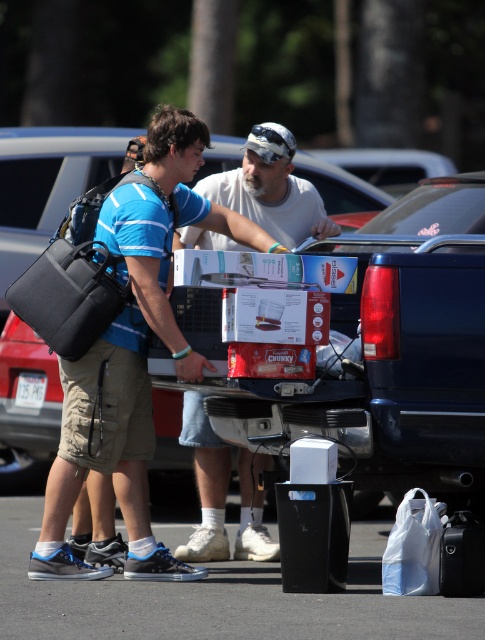
Question: Does red cardboard boxes at center appear over matte black backpack at left?

Choices:
 (A) yes
 (B) no

Answer: (A)

Question: Which point is farther to the camera?

Choices:
 (A) red cardboard boxes at center
 (B) matte black backpack at left
 (C) white matte shirt at center

Answer: (C)

Question: Considering the relative positions of red cardboard boxes at center and matte black backpack at left in the image provided, where is red cardboard boxes at center located with respect to matte black backpack at left?

Choices:
 (A) above
 (B) below

Answer: (A)

Question: Which object appears closest to the camera in this image?

Choices:
 (A) white matte shirt at center
 (B) matte black backpack at left

Answer: (B)

Question: Which point is farther to the camera?

Choices:
 (A) coord(231,173)
 (B) coord(477,300)
 (C) coord(123,452)

Answer: (A)

Question: In this image, where is matte black backpack at left located relative to white matte shirt at center?

Choices:
 (A) right
 (B) left

Answer: (B)